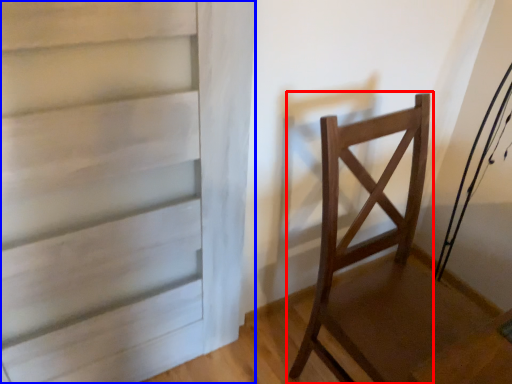
Question: Among these objects, which one is nearest to the camera, chair (highlighted by a red box) or door (highlighted by a blue box)?

Choices:
 (A) chair
 (B) door

Answer: (B)